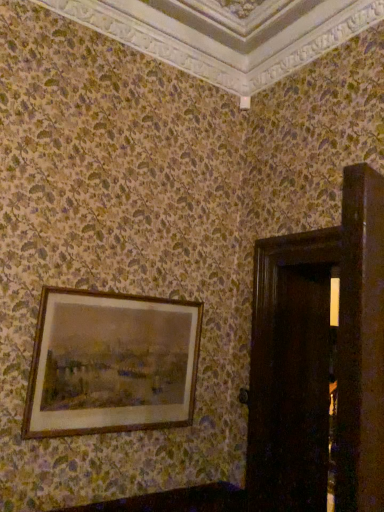
Locate an element on the screen. Image resolution: width=384 pixels, height=512 pixels. dark wood door at right is located at coordinates 290,372.

What do you see at coordinates (290, 372) in the screenshot? Image resolution: width=384 pixels, height=512 pixels. I see `dark wood door at right` at bounding box center [290, 372].

Measure the distance between wooden frame at upper left and camera.

They are 1.83 meters apart.

Where is `wooden frame at upper left`? The width and height of the screenshot is (384, 512). wooden frame at upper left is located at coordinates (111, 362).

The width and height of the screenshot is (384, 512). What do you see at coordinates (111, 362) in the screenshot?
I see `wooden frame at upper left` at bounding box center [111, 362].

This screenshot has height=512, width=384. Identify the location of dark wood door at right. (290, 372).

Which object is positioned more to the left, dark wood door at right or wooden frame at upper left?

wooden frame at upper left is more to the left.

In the image, is dark wood door at right positioned in front of or behind wooden frame at upper left?

Clearly, dark wood door at right is in front of wooden frame at upper left.

Which point is more distant from viewer, (x=254, y=353) or (x=27, y=401)?

The point (x=254, y=353) is behind.

From the image's perspective, is dark wood door at right over wooden frame at upper left?

No, from the image's perspective, dark wood door at right is not over wooden frame at upper left.

From a real-world perspective, which object stands above the other?

wooden frame at upper left.

Which object is wider, dark wood door at right or wooden frame at upper left?

With larger width is dark wood door at right.

Which of these two, dark wood door at right or wooden frame at upper left, stands taller?

Standing taller between the two is dark wood door at right.

Is dark wood door at right bigger than wooden frame at upper left?

Yes.

Would you say wooden frame at upper left is part of dark wood door at right's contents?

No, dark wood door at right does not contain wooden frame at upper left.

Are dark wood door at right and wooden frame at upper left far apart?

No, dark wood door at right is not far from wooden frame at upper left.

Is dark wood door at right facing away from wooden frame at upper left?

No, wooden frame at upper left is not at the back of dark wood door at right.

How far apart are dark wood door at right and wooden frame at upper left?

dark wood door at right is 26.43 inches from wooden frame at upper left.

You are a GUI agent. You are given a task and a screenshot of the screen. Output one action in this format:
    pyautogui.click(x=<x>, y=<y>)
    Task: Click on the picture frame above the dark wood door at right (from a real-world perspective)
    The width and height of the screenshot is (384, 512).
    Given the screenshot: What is the action you would take?
    pyautogui.click(x=111, y=362)

Looking at this image, does wooden frame at upper left appear on the right side of dark wood door at right?

In fact, wooden frame at upper left is to the left of dark wood door at right.

Is wooden frame at upper left closer to camera compared to dark wood door at right?

No, it is not.

Is point (197, 350) behind point (291, 343)?

Yes, it is.

From the image's perspective, between wooden frame at upper left and dark wood door at right, which one is located above?

wooden frame at upper left.

From a real-world perspective, is wooden frame at upper left positioned above or below dark wood door at right?

wooden frame at upper left is situated higher than dark wood door at right in the real world.

Looking at this image, is wooden frame at upper left wider or thinner than dark wood door at right?

In the image, wooden frame at upper left appears to be more narrow than dark wood door at right.

Which of these two, wooden frame at upper left or dark wood door at right, stands shorter?

Standing shorter between the two is wooden frame at upper left.

Considering the sizes of wooden frame at upper left and dark wood door at right in the image, is wooden frame at upper left bigger or smaller than dark wood door at right?

In the image, wooden frame at upper left appears to be smaller than dark wood door at right.

Is dark wood door at right a part of wooden frame at upper left?

No, dark wood door at right is not surrounded by wooden frame at upper left.

Is wooden frame at upper left touching dark wood door at right?

No, wooden frame at upper left is not next to dark wood door at right.

Is wooden frame at upper left facing towards dark wood door at right?

No.

This screenshot has height=512, width=384. Find the location of `picture frame to the left of dark wood door at right`. picture frame to the left of dark wood door at right is located at coordinates (111, 362).

The height and width of the screenshot is (512, 384). I want to click on door in front of the wooden frame at upper left, so click(x=290, y=372).

This screenshot has height=512, width=384. What are the coordinates of `picture frame lying behind the dark wood door at right` in the screenshot? It's located at (111, 362).